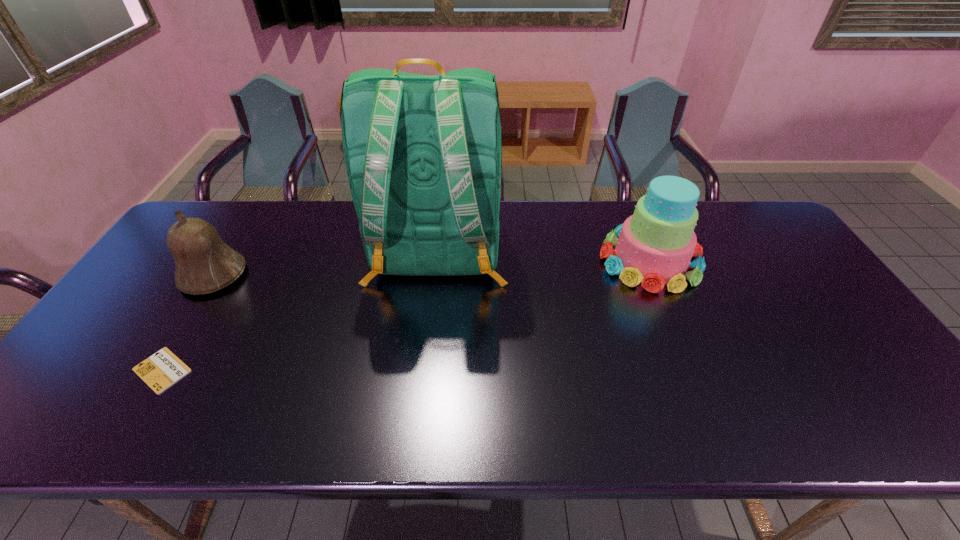
Identify the location of the second object from right to left. (423, 154).

Locate an element on the screen. backpack is located at coordinates (423, 154).

Identify the location of cake. This screenshot has width=960, height=540. (655, 246).

You are a GUI agent. You are given a task and a screenshot of the screen. Output one action in this format:
    pyautogui.click(x=<x>, y=<y>)
    Task: Click on the bell
    The width and height of the screenshot is (960, 540).
    Given the screenshot: What is the action you would take?
    pyautogui.click(x=203, y=262)

Image resolution: width=960 pixels, height=540 pixels. What are the coordinates of `the nearest object` in the screenshot? It's located at (161, 370).

Where is `the shortest object`? the shortest object is located at coordinates (161, 370).

Find the location of a particular element. vacant space situated 0.250m on the back of the backpack is located at coordinates (422, 395).

This screenshot has width=960, height=540. I want to click on vacant space located on the right of the rightmost object, so click(x=756, y=260).

The width and height of the screenshot is (960, 540). In order to click on vacant space located on the front of the bell in this screenshot , I will do tap(148, 380).

This screenshot has width=960, height=540. What are the coordinates of `vacant point located 0.310m on the right of the nearest object` in the screenshot? It's located at (322, 370).